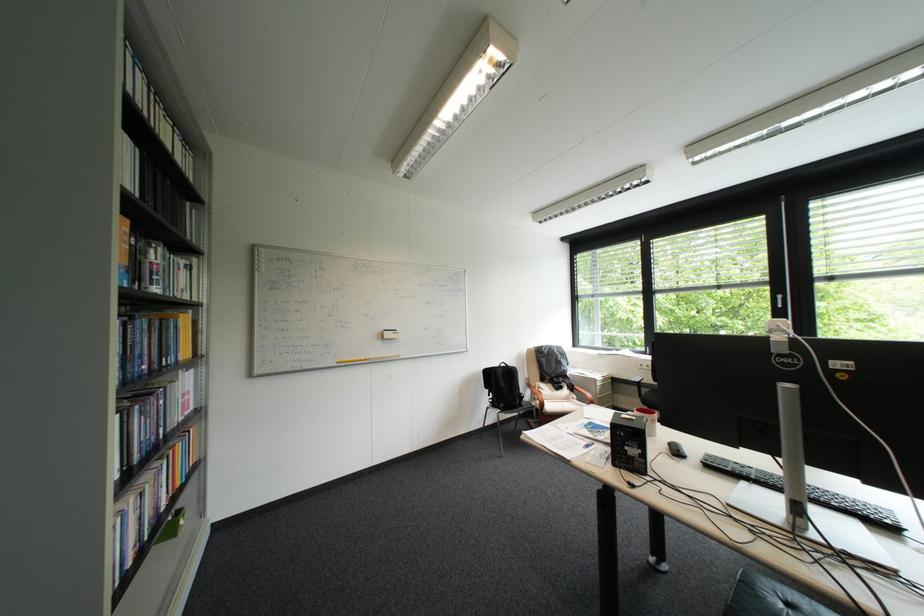
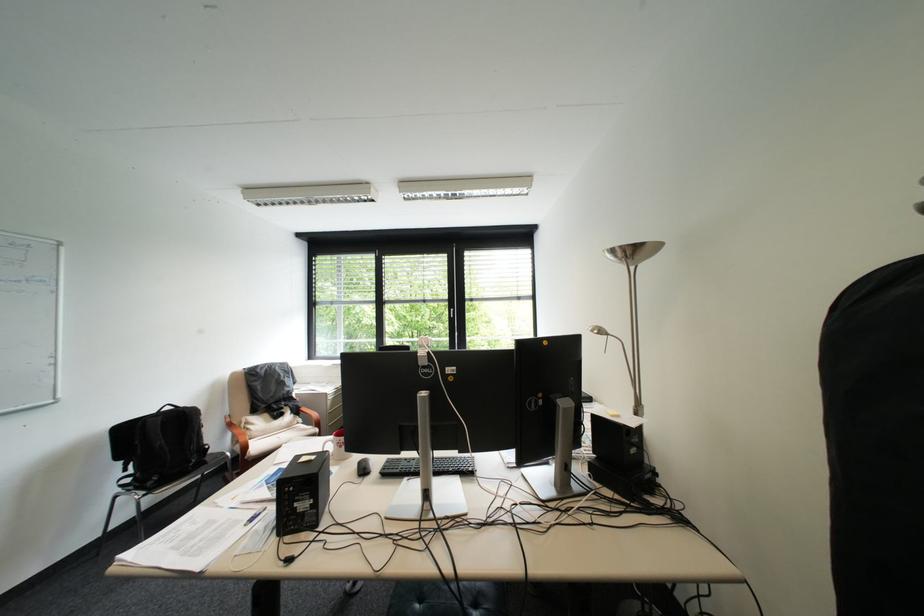
Locate, in the second image, the point that corresponds to (x=678, y=447) in the first image.

(369, 467)